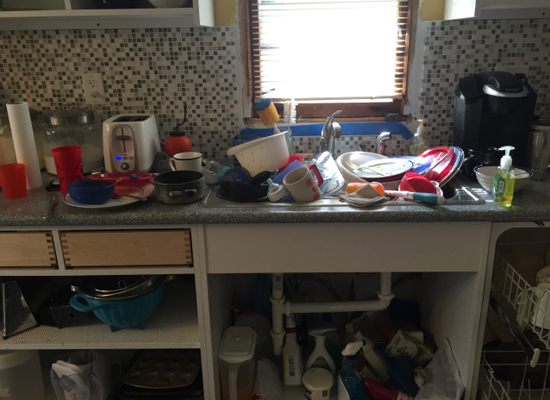
Find the location of a particular element. This screenshot has height=400, width=550. plumbing pipe is located at coordinates (371, 304), (317, 280).